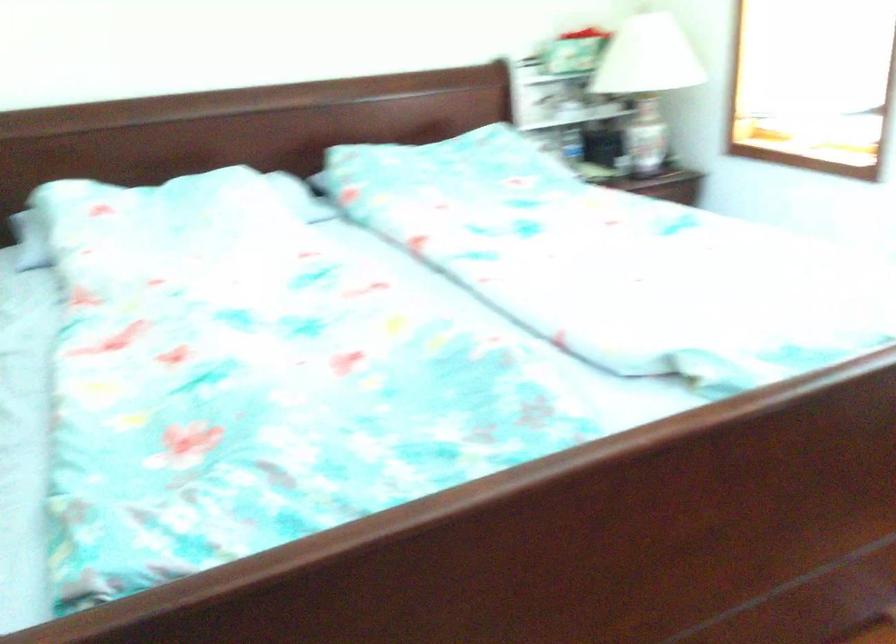
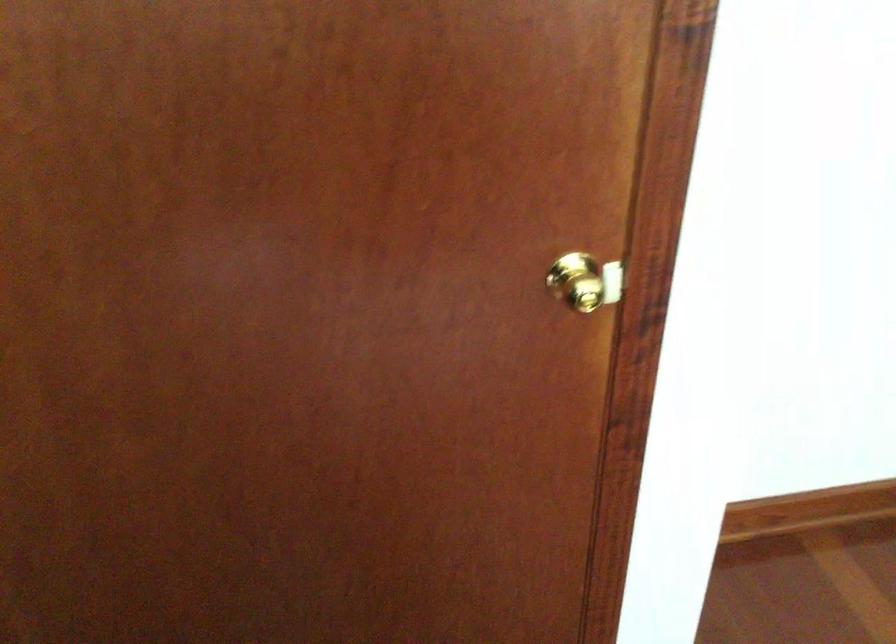
Based on the continuous images, in which direction is the camera rotating?

The camera rotated toward left-down.